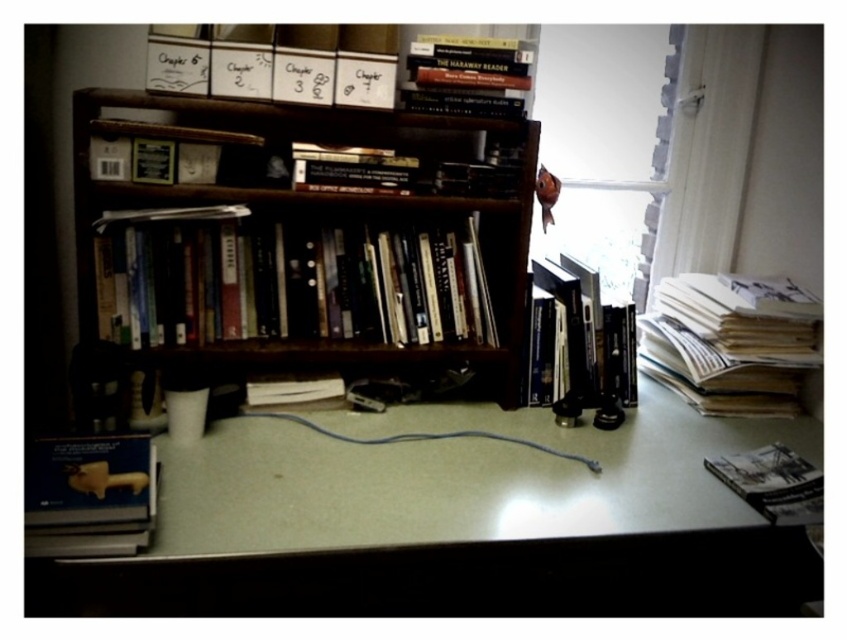
Question: Which point appears farthest from the camera in this image?

Choices:
 (A) (150, 452)
 (B) (740, 392)
 (C) (774, 524)

Answer: (B)

Question: Does white paper stack at right appear on the right side of matte black book at lower right?

Choices:
 (A) no
 (B) yes

Answer: (B)

Question: Which point is farther to the camera?

Choices:
 (A) (75, 497)
 (B) (779, 448)

Answer: (B)

Question: Does brown wooden bookshelf at center have a smaller size compared to matte black book at lower right?

Choices:
 (A) yes
 (B) no

Answer: (B)

Question: Can you confirm if brown wooden bookshelf at center is positioned to the right of white paper stack at right?

Choices:
 (A) no
 (B) yes

Answer: (A)

Question: Which of the following is the closest to the observer?

Choices:
 (A) (93, 472)
 (B) (421, 51)
 (C) (338, 252)

Answer: (A)